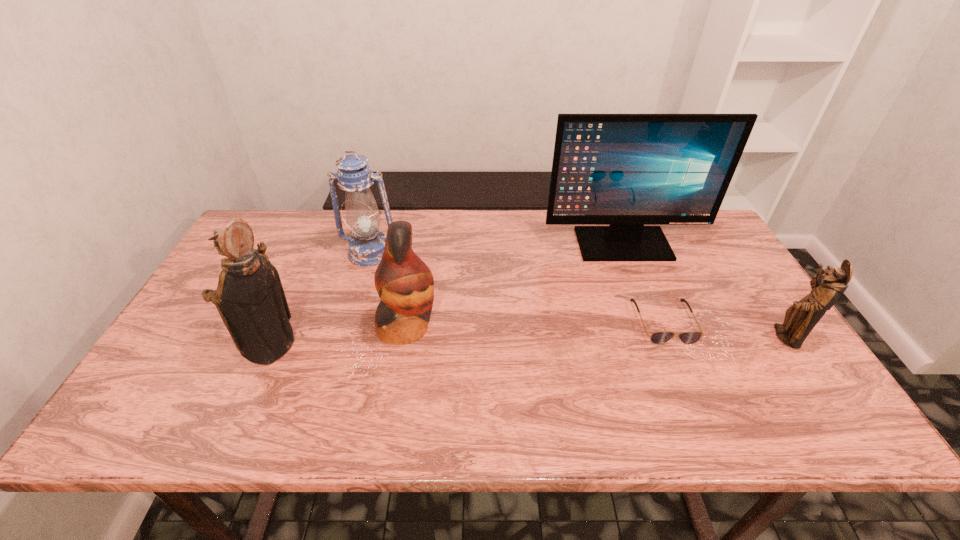
Where is `figurine situated at the right edge`? This screenshot has height=540, width=960. figurine situated at the right edge is located at coordinates (800, 318).

At what (x,y) coordinates should I click in order to perform the action: click on monitor that is at the right edge. Please return your answer as a coordinate pair (x, y). Looking at the image, I should click on (623, 170).

At what (x,y) coordinates should I click in order to perform the action: click on object that is at the far right corner. Please return your answer as a coordinate pair (x, y). This screenshot has height=540, width=960. Looking at the image, I should click on (623, 170).

You are a GUI agent. You are given a task and a screenshot of the screen. Output one action in this format:
    pyautogui.click(x=<x>, y=<y>)
    Task: Click on the free space at the far edge of the desktop
    Image resolution: width=960 pixels, height=540 pixels.
    Given the screenshot: What is the action you would take?
    point(541,244)

The image size is (960, 540). Find the location of `vacant space at the near edge`. vacant space at the near edge is located at coordinates (319, 382).

This screenshot has height=540, width=960. I want to click on free space at the right edge of the desktop, so click(746, 288).

Locate an element on the screen. vacant space at the far left corner of the desktop is located at coordinates (276, 211).

You are a GUI agent. You are given a task and a screenshot of the screen. Output one action in this format:
    pyautogui.click(x=<x>, y=<y>)
    Task: Click on the vacant space at the far right corner
    The height and width of the screenshot is (540, 960).
    Given the screenshot: What is the action you would take?
    pyautogui.click(x=700, y=230)

In the image, there is a desktop. In order to click on free region at the near right corner in this screenshot , I will do `click(777, 386)`.

Locate an element on the screen. Image resolution: width=960 pixels, height=540 pixels. vacant space in between the left figurine and the parrot is located at coordinates (339, 336).